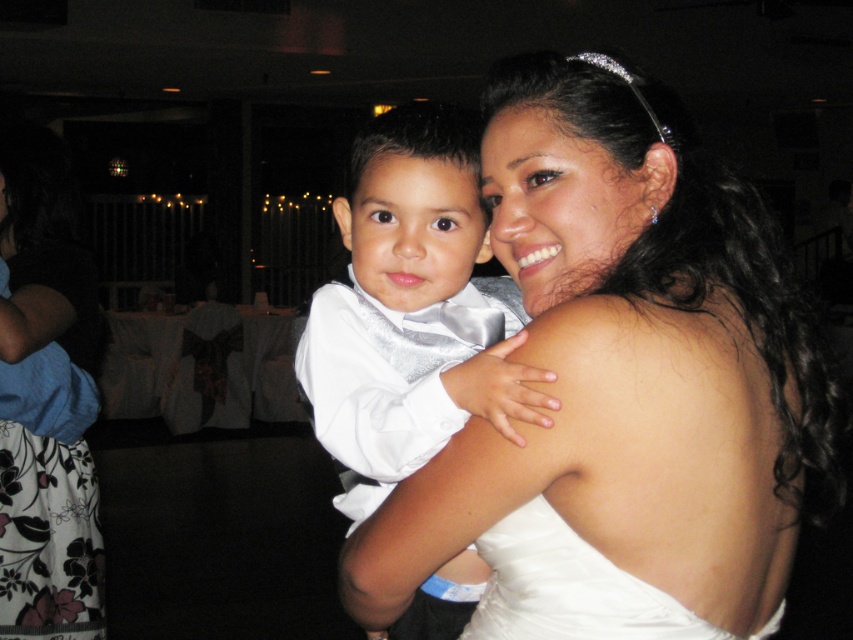
Question: Does white satin dress at upper center have a lesser width compared to white satin bow tie at center?

Choices:
 (A) no
 (B) yes

Answer: (A)

Question: Based on their relative distances, which object is farther from the white satin dress at center?

Choices:
 (A) floral print dress at lower left
 (B) white satin bow tie at center

Answer: (A)

Question: Which point appears farthest from the camera in this image?

Choices:
 (A) (531, 548)
 (B) (361, 412)

Answer: (B)

Question: Is white satin bow tie at center above floral print dress at lower left?

Choices:
 (A) no
 (B) yes

Answer: (B)

Question: Which of the following is the farthest from the observer?

Choices:
 (A) (314, 400)
 (B) (386, 616)

Answer: (A)

Question: Does white satin bow tie at center appear on the right side of white satin dress at center?

Choices:
 (A) yes
 (B) no

Answer: (B)